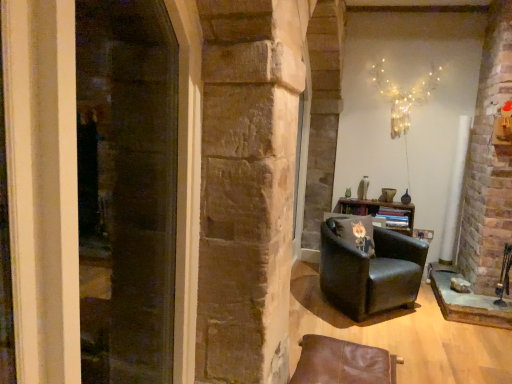
Question: Is illuminated wire at upper center surrounded by black leather armchair at center-right, which is the 1th chair from back to front?

Choices:
 (A) yes
 (B) no

Answer: (B)

Question: Considering the relative positions of black leather armchair at center-right, which ranks as the 2th chair in front-to-back order, and illuminated wire at upper center in the image provided, is black leather armchair at center-right, which ranks as the 2th chair in front-to-back order, in front of illuminated wire at upper center?

Choices:
 (A) yes
 (B) no

Answer: (A)

Question: Is black leather armchair at center-right, which is the 1th chair from back to front, not near illuminated wire at upper center?

Choices:
 (A) yes
 (B) no

Answer: (A)

Question: Can you confirm if black leather armchair at center-right, which is the 1th chair from back to front, is wider than illuminated wire at upper center?

Choices:
 (A) yes
 (B) no

Answer: (A)

Question: Considering the relative sizes of black leather armchair at center-right, which ranks as the 2th chair in front-to-back order, and illuminated wire at upper center in the image provided, is black leather armchair at center-right, which ranks as the 2th chair in front-to-back order, bigger than illuminated wire at upper center?

Choices:
 (A) no
 (B) yes

Answer: (B)

Question: Is point (409, 89) positioned closer to the camera than point (385, 248)?

Choices:
 (A) closer
 (B) farther

Answer: (B)

Question: Looking at the image, does illuminated wire at upper center seem bigger or smaller compared to black leather armchair at center-right, which is the 1th chair from back to front?

Choices:
 (A) small
 (B) big

Answer: (A)

Question: From the image's perspective, is illuminated wire at upper center positioned above or below black leather armchair at center-right, which ranks as the 2th chair in front-to-back order?

Choices:
 (A) above
 (B) below

Answer: (A)

Question: Is illuminated wire at upper center in front of or behind black leather armchair at center-right, which ranks as the 2th chair in front-to-back order, in the image?

Choices:
 (A) front
 (B) behind

Answer: (B)

Question: Is transparent glass screen door at left bigger or smaller than illuminated wire at upper center?

Choices:
 (A) small
 (B) big

Answer: (A)

Question: Does point (143, 127) appear closer or farther from the camera than point (394, 109)?

Choices:
 (A) closer
 (B) farther

Answer: (A)

Question: Visually, is transparent glass screen door at left positioned to the left or to the right of illuminated wire at upper center?

Choices:
 (A) right
 (B) left

Answer: (B)

Question: Is transparent glass screen door at left taller or shorter than illuminated wire at upper center?

Choices:
 (A) tall
 (B) short

Answer: (A)

Question: From their relative heights in the image, would you say black fabric pillow at center-right is taller or shorter than black leather armchair at center-right, which ranks as the 2th chair in front-to-back order?

Choices:
 (A) tall
 (B) short

Answer: (B)

Question: Based on their sizes in the image, would you say black fabric pillow at center-right is bigger or smaller than black leather armchair at center-right, which ranks as the 2th chair in front-to-back order?

Choices:
 (A) big
 (B) small

Answer: (B)